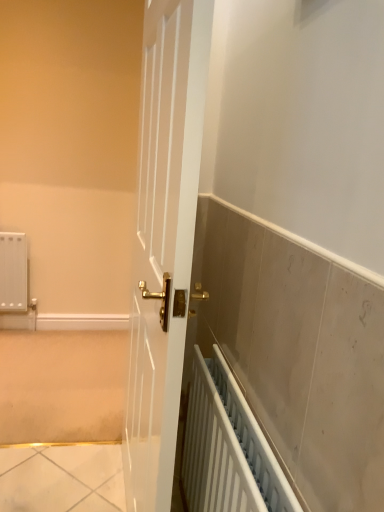
This screenshot has height=512, width=384. What do you see at coordinates (227, 448) in the screenshot?
I see `white plastic radiator at lower right` at bounding box center [227, 448].

Identify the location of white plastic radiator at lower right. (227, 448).

Where is `white plastic radiator at lower right`? white plastic radiator at lower right is located at coordinates [x=227, y=448].